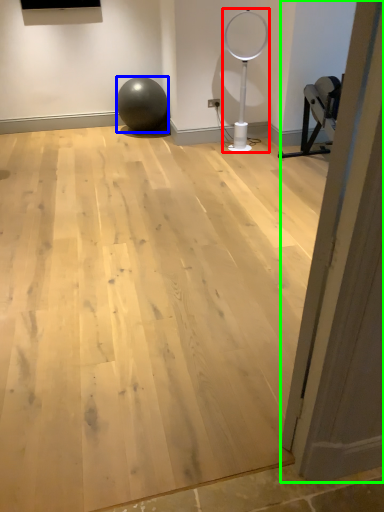
Question: Which object is the farthest from basketball hoop (highlighted by a red box)? Choose among these: ball (highlighted by a blue box) or door (highlighted by a green box).

Choices:
 (A) ball
 (B) door

Answer: (B)